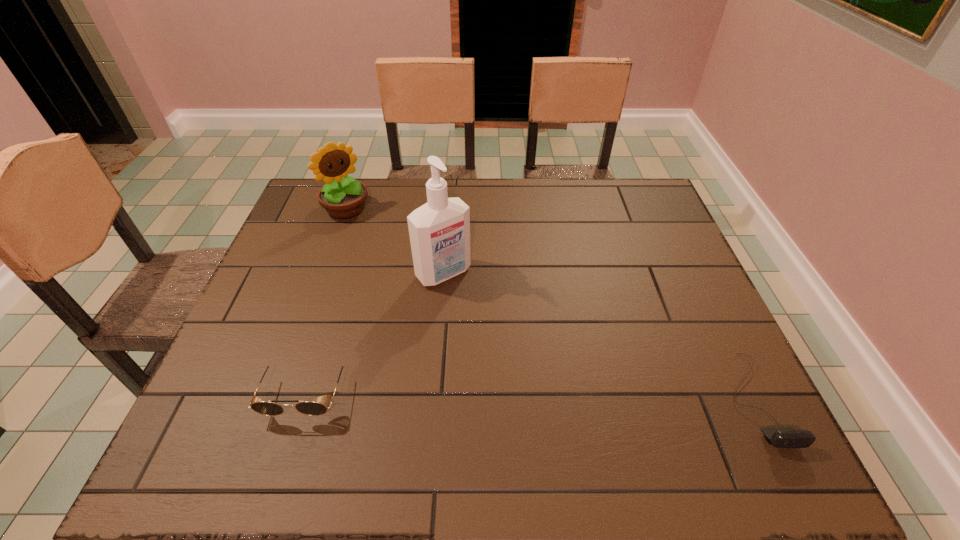
Find the location of a particular element. The width and height of the screenshot is (960, 540). free space between the second shortest object and the cleansing agent is located at coordinates (374, 332).

The image size is (960, 540). I want to click on vacant area that lies between the second farthest object and the rightmost object, so click(599, 336).

This screenshot has width=960, height=540. What are the coordinates of `vacant area that lies between the cleansing agent and the farthest object` in the screenshot? It's located at (395, 241).

Locate an element on the screen. This screenshot has height=540, width=960. unoccupied position between the sunflower and the third nearest object is located at coordinates (395, 241).

Identify the location of free space between the cleansing agent and the sunflower. (395, 241).

You are a GUI agent. You are given a task and a screenshot of the screen. Output one action in this format:
    pyautogui.click(x=<x>, y=<y>)
    Task: Click on the unoccupied position between the tallest object and the sunglasses
    
    Given the screenshot: What is the action you would take?
    (x=374, y=332)

Where is `unoccupied position between the tallest object and the sunflower`? The image size is (960, 540). unoccupied position between the tallest object and the sunflower is located at coordinates (395, 241).

The image size is (960, 540). I want to click on unoccupied area between the third object from left to right and the shortest object, so click(599, 336).

You are a GUI agent. You are given a task and a screenshot of the screen. Output one action in this format:
    pyautogui.click(x=<x>, y=<y>)
    Task: Click on the free space between the third shortest object and the webcam
    The width and height of the screenshot is (960, 540).
    Given the screenshot: What is the action you would take?
    pyautogui.click(x=551, y=303)

Locate an element on the screen. the third closest object to the sunglasses is located at coordinates (781, 437).